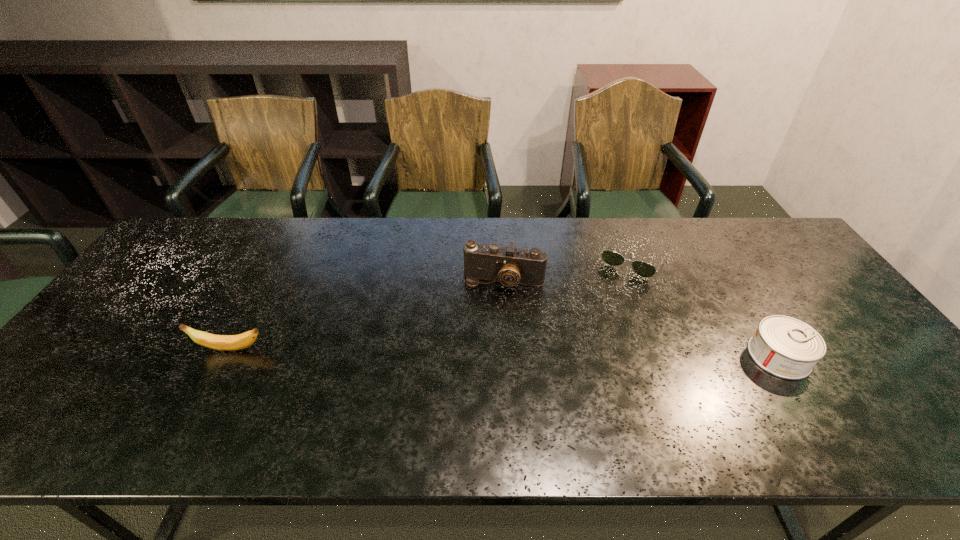
Find the location of a particular element. vacant space that satisfies the following two spatial constraints: 1. on the back side of the second object from right to left; 2. on the right side of the tallest object is located at coordinates (503, 257).

You are a GUI agent. You are given a task and a screenshot of the screen. Output one action in this format:
    pyautogui.click(x=<x>, y=<y>)
    Task: Click on the free space that satisfies the following two spatial constraints: 1. on the front side of the rightmost object; 2. on the left side of the second object from right to left
    
    Given the screenshot: What is the action you would take?
    pyautogui.click(x=674, y=356)

Image resolution: width=960 pixels, height=540 pixels. I want to click on free space that satisfies the following two spatial constraints: 1. on the front side of the second object from left to right; 2. on the left side of the can, so click(509, 356).